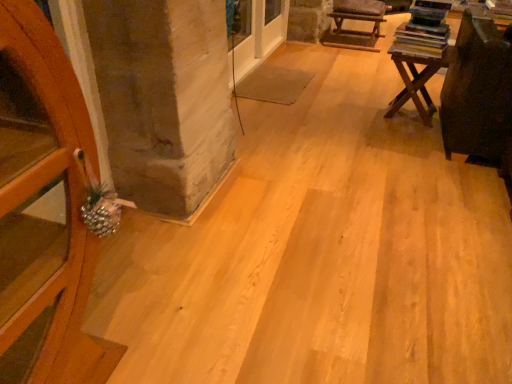
You are a GUI agent. You are given a task and a screenshot of the screen. Output one action in this format:
    pyautogui.click(x=<x>, y=<y>)
    Task: Click on the vacant space positioned to the left of wooden table at right
    
    Given the screenshot: What is the action you would take?
    pyautogui.click(x=354, y=112)